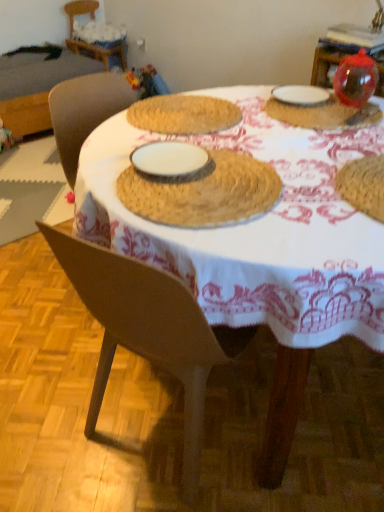
Find the location of a particular element. This screenshot has width=384, height=512. blank space to the left of transparent plastic ornament at upper right, the third tableware from the left is located at coordinates (294, 108).